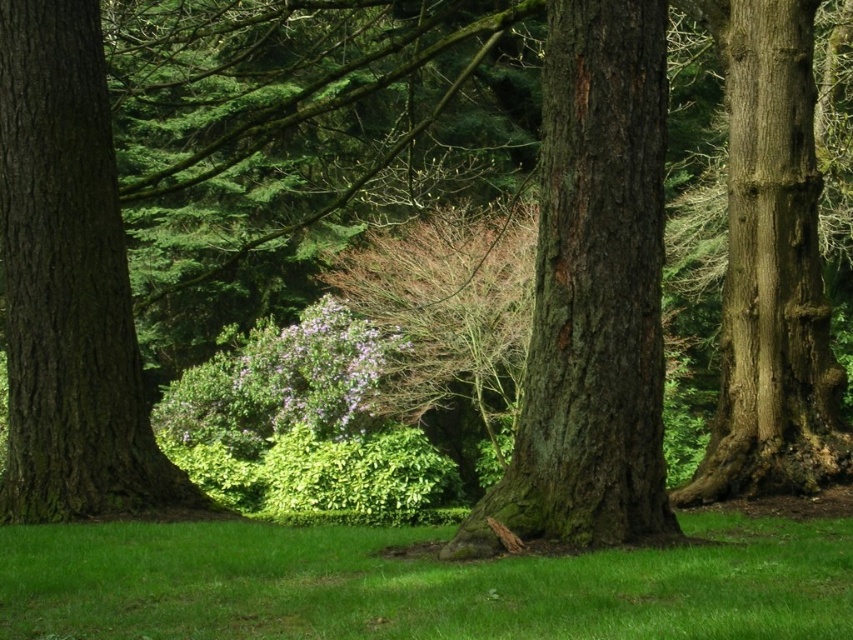
Between smooth brown tree trunk at center and smooth brown bark at right, which one has more height?

Standing taller between the two is smooth brown bark at right.

Is smooth brown tree trunk at center positioned behind smooth brown bark at right?

No.

Which is in front, point (88, 301) or point (778, 294)?

Point (88, 301) is in front.

The image size is (853, 640). I want to click on smooth brown tree trunk at center, so click(68, 285).

Does green grassy at center appear over smooth brown bark at right?

Incorrect, green grassy at center is not positioned above smooth brown bark at right.

Is green grassy at center wider than smooth brown bark at right?

No.

Is point (729, 582) positioned in front of point (763, 0)?

Yes, point (729, 582) is in front of point (763, 0).

Locate an element on the screen. The image size is (853, 640). green grassy at center is located at coordinates (419, 584).

Who is shorter, green grassy at center or smooth brown tree trunk at center?

green grassy at center is shorter.

Which is more to the left, green grassy at center or smooth brown tree trunk at center?

From the viewer's perspective, smooth brown tree trunk at center appears more on the left side.

Between point (20, 547) and point (84, 128), which one is positioned behind?

Positioned behind is point (84, 128).

I want to click on green grassy at center, so click(419, 584).